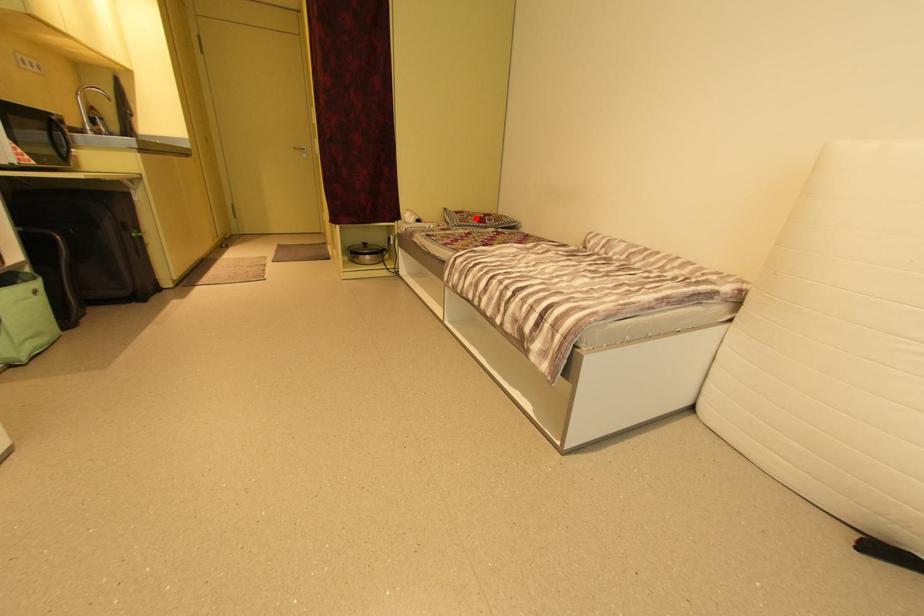
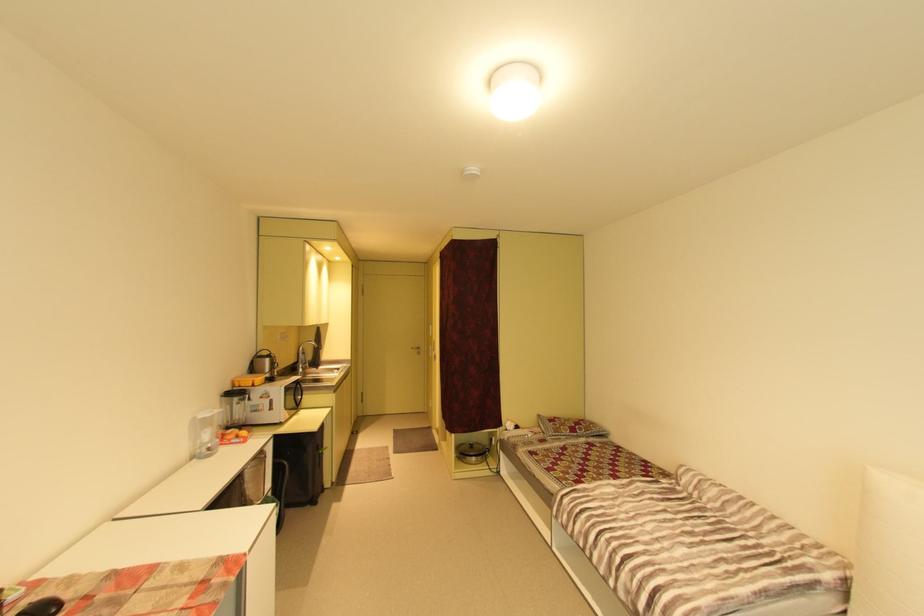
Question: I am providing you with two images of the same scene from different viewpoints. In image1, a red point is highlighted. Considering the same 3D point in image2, which of the following is correct?

Choices:
 (A) It is closer
 (B) It is farther

Answer: (B)